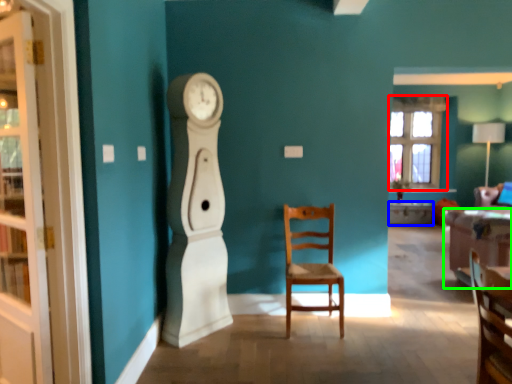
Question: Which object is positioned closest to window (highlighted by a red box)? Select from desk (highlighted by a blue box) and studio couch (highlighted by a green box).

Choices:
 (A) desk
 (B) studio couch

Answer: (A)